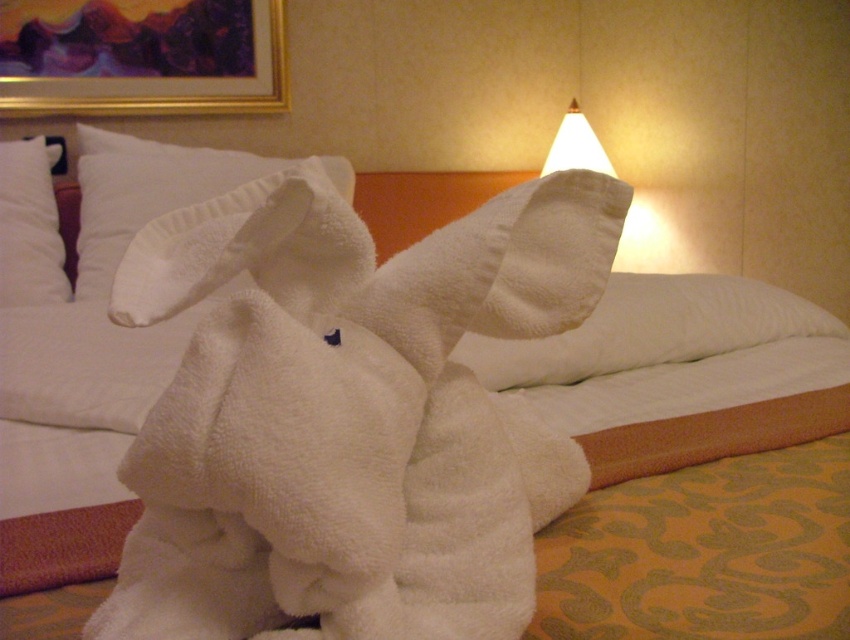
Question: Which object appears closest to the camera in this image?

Choices:
 (A) white soft pillow at center
 (B) white soft pillow at upper left
 (C) white quilted pillow at center

Answer: (C)

Question: Is white quilted pillow at center in front of white paper lampshade at upper center?

Choices:
 (A) no
 (B) yes

Answer: (B)

Question: Is white soft pillow at upper left thinner than white paper lampshade at upper center?

Choices:
 (A) no
 (B) yes

Answer: (B)

Question: Which point is closer to the camera?

Choices:
 (A) (581, 131)
 (B) (689, 289)
 (C) (4, 168)

Answer: (B)

Question: Can you confirm if white quilted pillow at center is positioned to the left of white soft pillow at upper left?

Choices:
 (A) no
 (B) yes

Answer: (A)

Question: Which object is the closest to the white soft pillow at center?

Choices:
 (A) white paper lampshade at upper center
 (B) white soft pillow at upper left
 (C) white quilted pillow at center

Answer: (B)